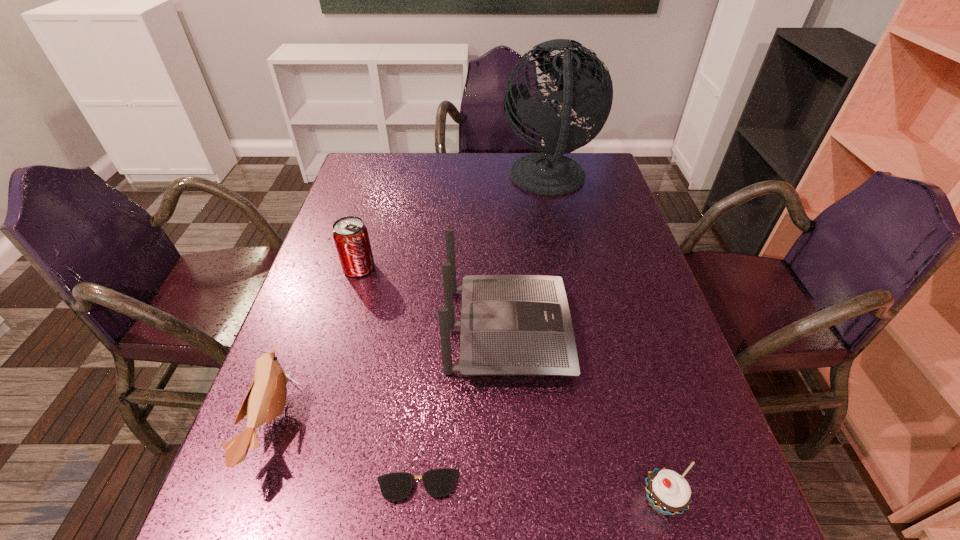
Locate an element on the screen. The height and width of the screenshot is (540, 960). vacant position in the image that satisfies the following two spatial constraints: 1. at the beak of the bird; 2. on the back side of the shortest object is located at coordinates (251, 485).

The image size is (960, 540). In order to click on vacant area in the image that satisfies the following two spatial constraints: 1. on the front side of the second object from left to right; 2. on the left side of the spectacles in this screenshot , I will do `click(296, 485)`.

In order to click on vacant space that satisfies the following two spatial constraints: 1. on the front-facing side of the tallest object; 2. on the back side of the cupcake in this screenshot , I will do `click(614, 501)`.